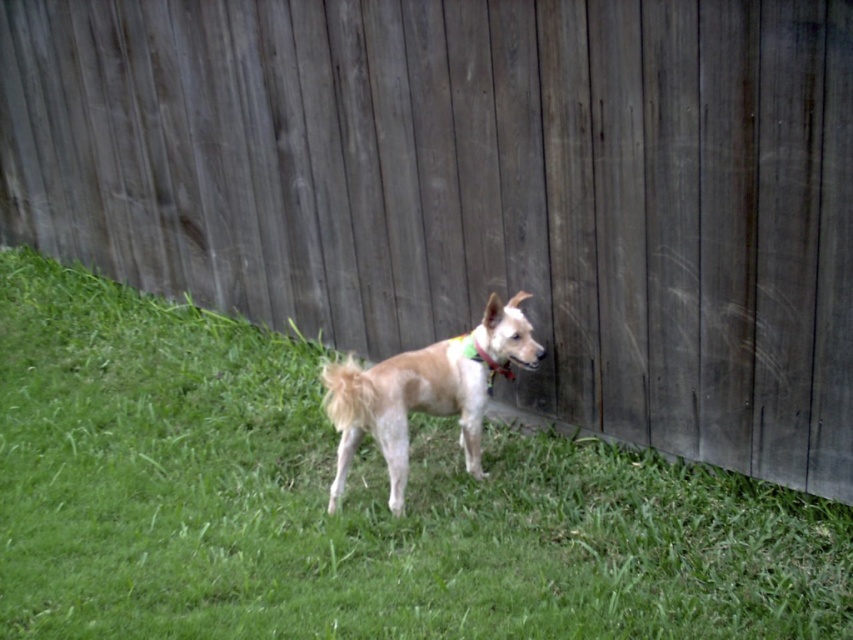
Question: Considering the relative positions of green grass at center and multicolored fabric neckband at center in the image provided, where is green grass at center located with respect to multicolored fabric neckband at center?

Choices:
 (A) left
 (B) right

Answer: (A)

Question: Which is nearer to the multicolored fabric neckband at center?

Choices:
 (A) fuzzy tan dog at center
 (B) green grass at center

Answer: (A)

Question: Observing the image, what is the correct spatial positioning of green grass at center in reference to multicolored fabric neckband at center?

Choices:
 (A) right
 (B) left

Answer: (B)

Question: Considering the real-world distances, which object is farthest from the green grass at center?

Choices:
 (A) fuzzy tan dog at center
 (B) multicolored fabric neckband at center

Answer: (B)

Question: Estimate the real-world distances between objects in this image. Which object is closer to the green grass at center?

Choices:
 (A) fuzzy tan dog at center
 (B) multicolored fabric neckband at center

Answer: (A)

Question: From the image, what is the correct spatial relationship of green grass at center in relation to fuzzy tan dog at center?

Choices:
 (A) left
 (B) right

Answer: (A)